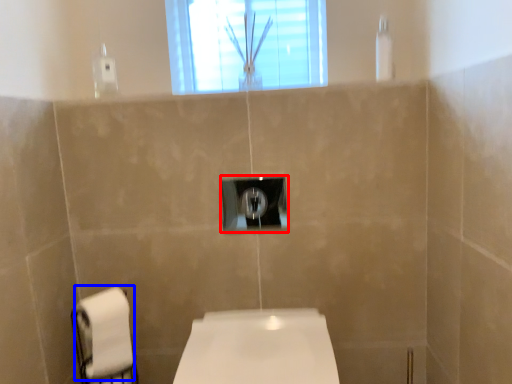
Question: Which object is closer to the camera taking this photo, light switch (highlighted by a red box) or toilet paper (highlighted by a blue box)?

Choices:
 (A) light switch
 (B) toilet paper

Answer: (B)